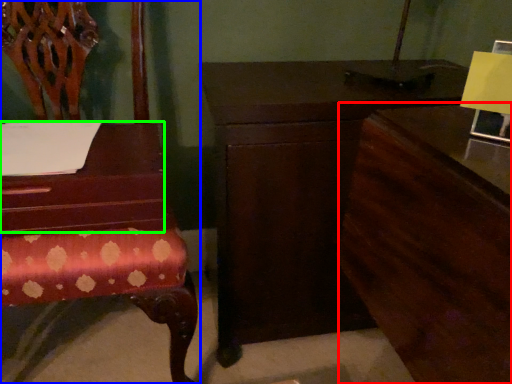
Question: Which object is positioned farthest from dresser (highlighted by a red box)? Select from chair (highlighted by a blue box) and table (highlighted by a green box).

Choices:
 (A) chair
 (B) table

Answer: (A)